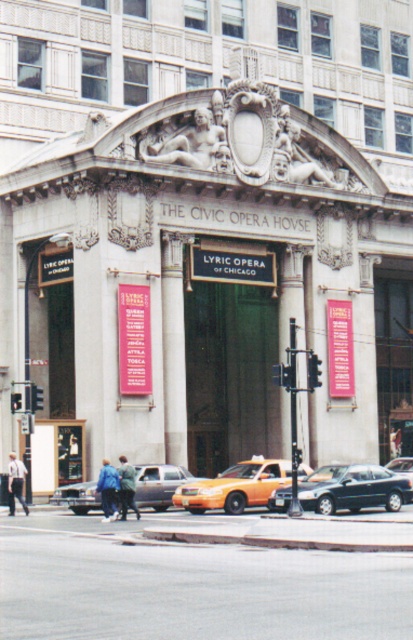
You are a photographer planning to capture the Civic Opera House entrance with both the orange matte taxi at center and the marble statue at center in the frame. Given their sizes, which object will occupy more horizontal space in your photo?

The orange matte taxi at center is wider than the marble statue at center, so it will occupy more horizontal space in the photo.

You are a delivery person needing to park your 2.5 meter wide van between the shiny black sedan at center and the metallic silver sedan at lower left. Is there enough space for your van?

The shiny black sedan at center is 6.56 meters from the metallic silver sedan at lower left. Since your van is only 2.5 meters wide, there is sufficient space between them to park your van.

In the scene shown: You are a tour guide leading a group to the entrance of The Civic Opera House. You notice an orange matte taxi at center and a marble statue at center. If your group wants to take a photo with both objects in the frame, will they need a wide angle lens? Explain your reasoning based on the distance between the two objects.

The orange matte taxi at center and marble statue at center are 15.96 meters apart. To capture both in a single photo frame, a wide angle lens would be necessary due to the significant distance between them.